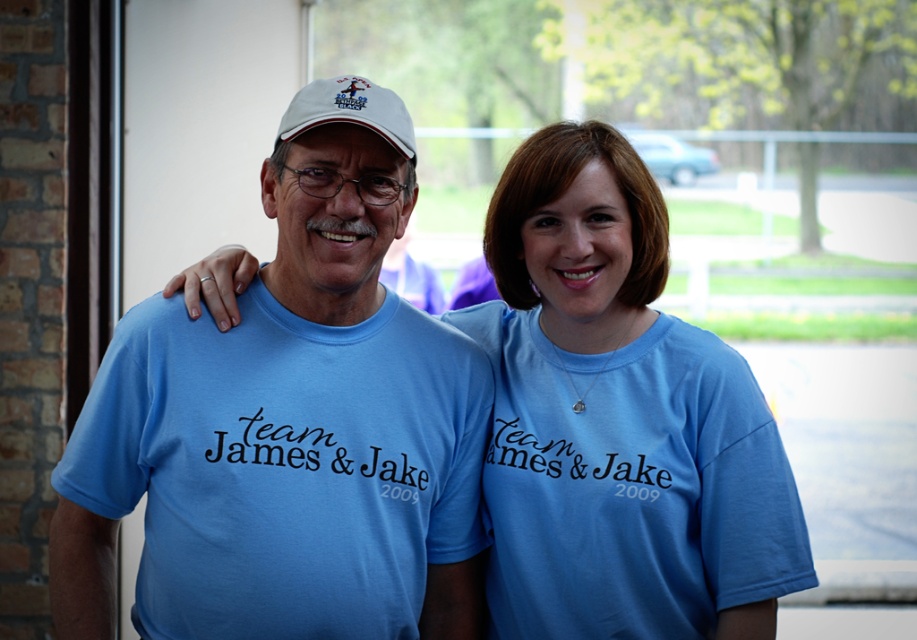
What is the color of the clothing item located at the coordinates point (617, 420) in the image?

The point (617, 420) corresponds to the blue cotton t shirt at center, so the clothing item there is blue.